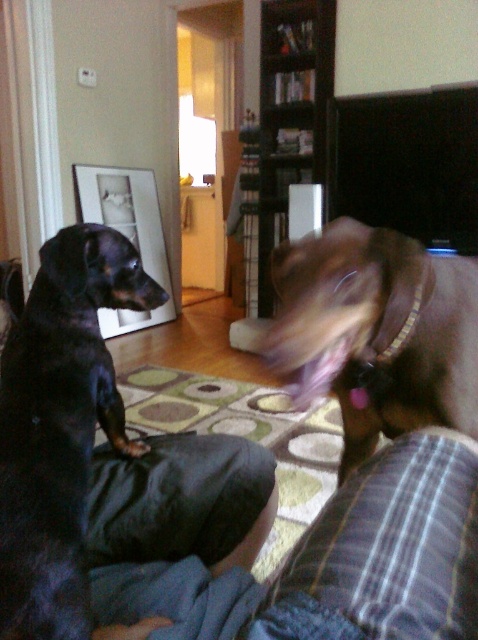
Question: Observing the image, what is the correct spatial positioning of black smooth dog at left in reference to brown smooth dog at center?

Choices:
 (A) left
 (B) right

Answer: (A)

Question: Does black smooth dog at left have a greater width compared to brown smooth dog at center?

Choices:
 (A) no
 (B) yes

Answer: (A)

Question: Which point appears closest to the camera in this image?

Choices:
 (A) (122, 288)
 (B) (340, 248)

Answer: (B)

Question: Which point is closer to the camera?

Choices:
 (A) black smooth dog at left
 (B) brown smooth dog at center

Answer: (A)

Question: Does black smooth dog at left appear over brown smooth dog at center?

Choices:
 (A) no
 (B) yes

Answer: (A)